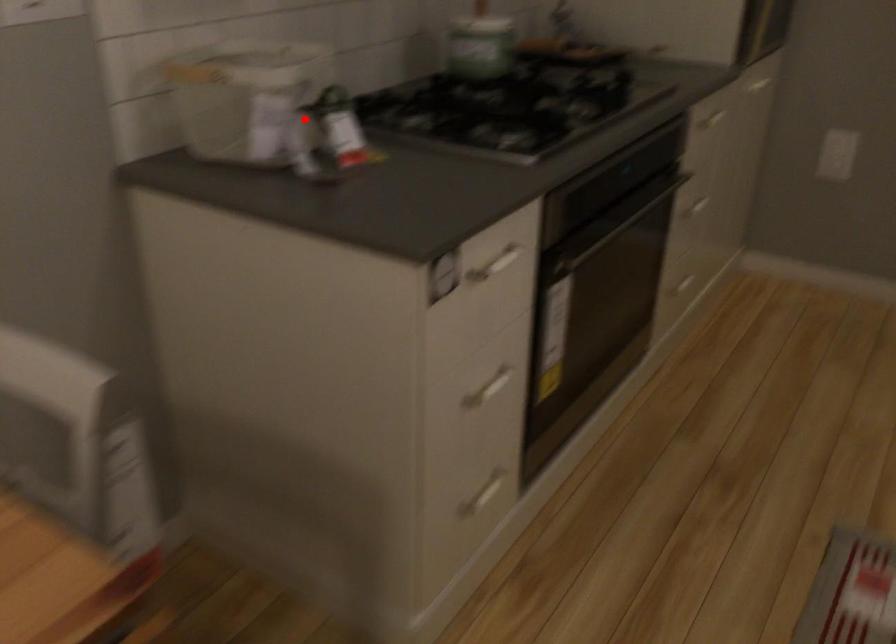
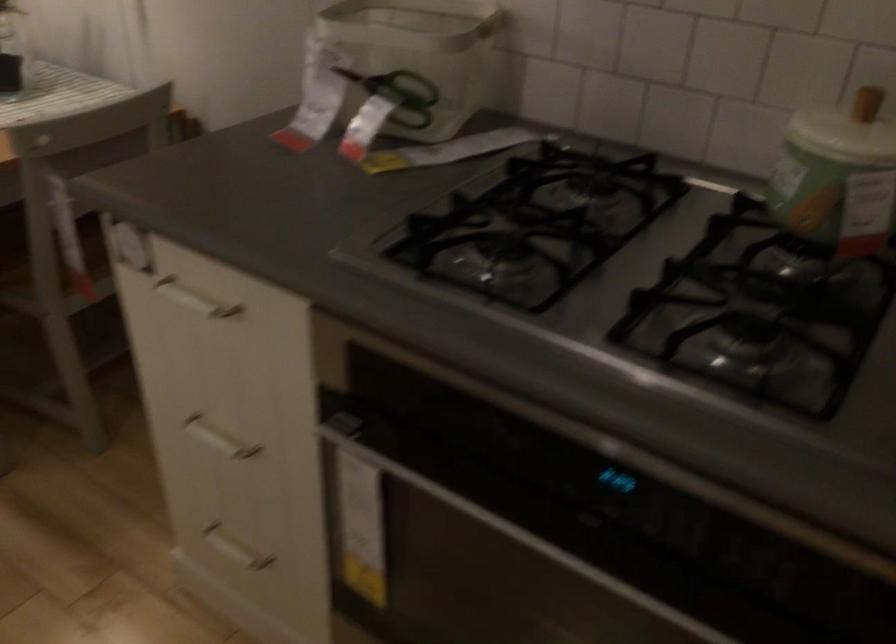
In the second image, find the point that corresponds to the highlighted location in the first image.

(399, 93)